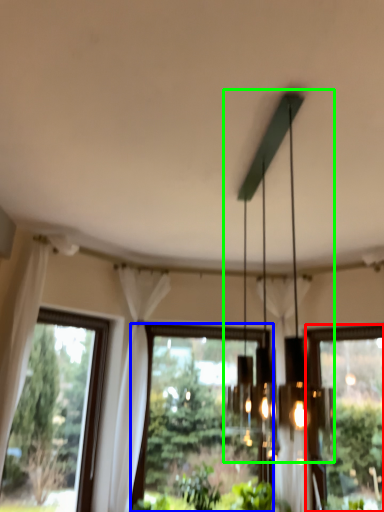
Question: Estimate the real-world distances between objects in this image. Which object is closer to window (highlighted by a red box), window (highlighted by a blue box) or chandelier (highlighted by a green box)?

Choices:
 (A) window
 (B) chandelier

Answer: (A)